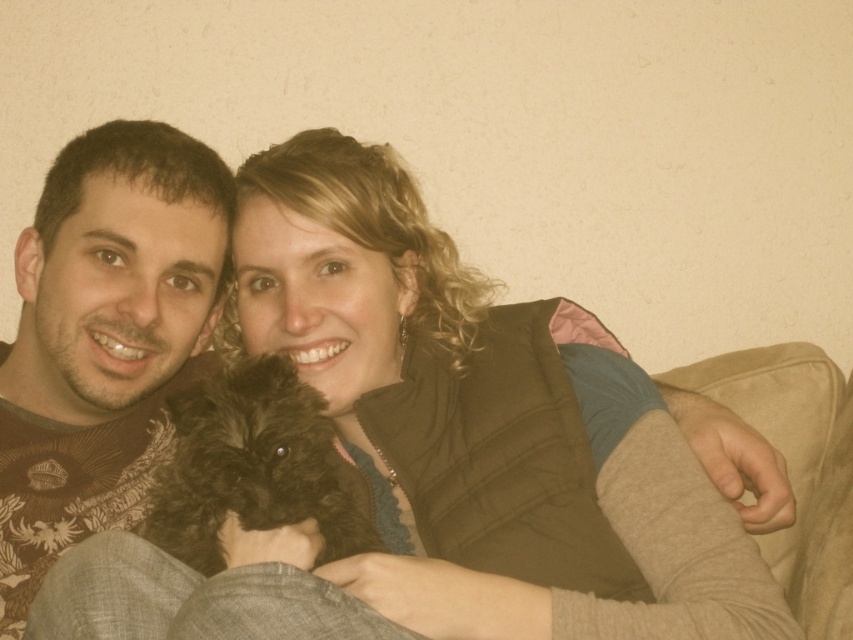
Question: Is dark brown sweater at left to the right of black fluffy dog at center from the viewer's perspective?

Choices:
 (A) no
 (B) yes

Answer: (A)

Question: Which point is farther from the camera taking this photo?

Choices:
 (A) (86, 488)
 (B) (317, 465)

Answer: (A)

Question: Which of the following is the closest to the observer?

Choices:
 (A) dark brown sweater at left
 (B) black fluffy dog at center

Answer: (B)

Question: Does dark brown sweater at left appear on the left side of black fluffy dog at center?

Choices:
 (A) yes
 (B) no

Answer: (A)

Question: Is the position of dark brown sweater at left more distant than that of black fluffy dog at center?

Choices:
 (A) yes
 (B) no

Answer: (A)